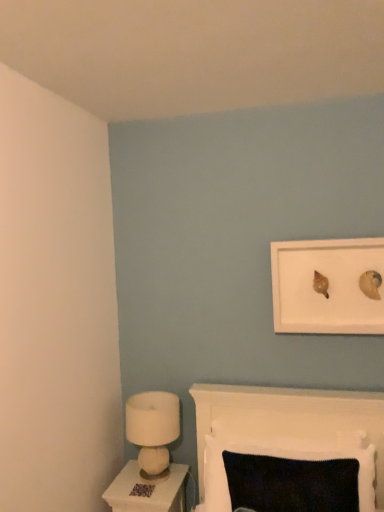
The image size is (384, 512). What do you see at coordinates (291, 416) in the screenshot? I see `knitted fabric cushion at lower center` at bounding box center [291, 416].

This screenshot has width=384, height=512. Identify the location of white matte picture frame at upper right. (328, 286).

Measure the distance between white glossy nightstand at lower left and camera.

white glossy nightstand at lower left is 5.87 feet from camera.

In order to face brown textured carpet at lower center, should I rotate leftwards or rightwards?

It's best to rotate left around 6.460 degrees.

This screenshot has width=384, height=512. I want to click on white felt lamp at lower left, so click(x=153, y=429).

Can you confirm if white matte picture frame at upper right is positioned to the left of white felt lamp at lower left?

No, white matte picture frame at upper right is not to the left of white felt lamp at lower left.

From the image's perspective, is white matte picture frame at upper right above or below white felt lamp at lower left?

white matte picture frame at upper right is situated higher than white felt lamp at lower left in the image.

Is white matte picture frame at upper right with white felt lamp at lower left?

No, white matte picture frame at upper right is not making contact with white felt lamp at lower left.

From the image's perspective, which one is positioned higher, brown textured carpet at lower center or white matte picture frame at upper right?

white matte picture frame at upper right appears higher in the image.

Considering the relative sizes of brown textured carpet at lower center and white matte picture frame at upper right in the image provided, is brown textured carpet at lower center thinner than white matte picture frame at upper right?

Yes, brown textured carpet at lower center is thinner than white matte picture frame at upper right.

Considering the positions of objects brown textured carpet at lower center and white matte picture frame at upper right in the image provided, who is in front, brown textured carpet at lower center or white matte picture frame at upper right?

white matte picture frame at upper right is closer to the camera.

The width and height of the screenshot is (384, 512). I want to click on picture frame that appears on the right of knitted fabric cushion at lower center, so click(x=328, y=286).

Considering the sizes of objects knitted fabric cushion at lower center and white matte picture frame at upper right in the image provided, who is bigger, knitted fabric cushion at lower center or white matte picture frame at upper right?

knitted fabric cushion at lower center.

Would you say knitted fabric cushion at lower center is to the left or to the right of white matte picture frame at upper right in the picture?

From the image, it's evident that knitted fabric cushion at lower center is to the left of white matte picture frame at upper right.

Is the surface of knitted fabric cushion at lower center in direct contact with white matte picture frame at upper right?

No, knitted fabric cushion at lower center is not next to white matte picture frame at upper right.

From the picture: Looking at the image, does knitted fabric cushion at lower center seem bigger or smaller compared to white glossy nightstand at lower left?

Clearly, knitted fabric cushion at lower center is larger in size than white glossy nightstand at lower left.

The height and width of the screenshot is (512, 384). I want to click on furniture to the right of white glossy nightstand at lower left, so click(291, 416).

Is knitted fabric cushion at lower center positioned far away from white glossy nightstand at lower left?

No, knitted fabric cushion at lower center is not far away from white glossy nightstand at lower left.

Is brown textured carpet at lower center oriented towards white felt lamp at lower left?

No, brown textured carpet at lower center is not aimed at white felt lamp at lower left.

Considering the sizes of objects brown textured carpet at lower center and white felt lamp at lower left in the image provided, who is bigger, brown textured carpet at lower center or white felt lamp at lower left?

With larger size is white felt lamp at lower left.

Between brown textured carpet at lower center and white felt lamp at lower left, which one is positioned behind?

white felt lamp at lower left is more distant.

From the image's perspective, does brown textured carpet at lower center appear lower than white felt lamp at lower left?

Correct, brown textured carpet at lower center appears lower than white felt lamp at lower left in the image.

Would you say knitted fabric cushion at lower center is a long distance from brown textured carpet at lower center?

Actually, knitted fabric cushion at lower center and brown textured carpet at lower center are a little close together.

Is knitted fabric cushion at lower center inside the boundaries of brown textured carpet at lower center, or outside?

knitted fabric cushion at lower center cannot be found inside brown textured carpet at lower center.

What's the angular difference between knitted fabric cushion at lower center and brown textured carpet at lower center's facing directions?

The facing directions of knitted fabric cushion at lower center and brown textured carpet at lower center are 0.849 degrees apart.

Which object is positioned more to the left, knitted fabric cushion at lower center or brown textured carpet at lower center?

Positioned to the left is brown textured carpet at lower center.

Does white glossy nightstand at lower left touch white matte picture frame at upper right?

There is a gap between white glossy nightstand at lower left and white matte picture frame at upper right.

Looking at this image, between white glossy nightstand at lower left and white matte picture frame at upper right, which one has smaller width?

white matte picture frame at upper right.

From the image's perspective, is white glossy nightstand at lower left under white matte picture frame at upper right?

Yes, from the image's perspective, white glossy nightstand at lower left is below white matte picture frame at upper right.

Where is `lamp that appears below the white matte picture frame at upper right (from the image's perspective)`? The width and height of the screenshot is (384, 512). lamp that appears below the white matte picture frame at upper right (from the image's perspective) is located at coordinates (153, 429).

Find the location of a particular element. The width and height of the screenshot is (384, 512). footprint behind the white matte picture frame at upper right is located at coordinates (142, 490).

From the image, which object appears to be nearer to white matte picture frame at upper right, knitted fabric cushion at lower center or white felt lamp at lower left?

Based on the image, knitted fabric cushion at lower center appears to be nearer to white matte picture frame at upper right.

Based on their spatial positions, is white matte picture frame at upper right or knitted fabric cushion at lower center closer to brown textured carpet at lower center?

knitted fabric cushion at lower center is closer to brown textured carpet at lower center.

Consider the image. Which object lies further to the anchor point knitted fabric cushion at lower center, white matte picture frame at upper right or white felt lamp at lower left?

Among the two, white matte picture frame at upper right is located further to knitted fabric cushion at lower center.

Which object lies nearer to the anchor point white glossy nightstand at lower left, brown textured carpet at lower center or white felt lamp at lower left?

Based on the image, brown textured carpet at lower center appears to be nearer to white glossy nightstand at lower left.

Which object lies nearer to the anchor point white glossy nightstand at lower left, knitted fabric cushion at lower center or white felt lamp at lower left?

white felt lamp at lower left.

From the image, which object appears to be farther from white glossy nightstand at lower left, white felt lamp at lower left or brown textured carpet at lower center?

white felt lamp at lower left is further to white glossy nightstand at lower left.

When comparing their distances from white felt lamp at lower left, does knitted fabric cushion at lower center or brown textured carpet at lower center seem closer?

Based on the image, brown textured carpet at lower center appears to be nearer to white felt lamp at lower left.

Which object lies nearer to the anchor point white matte picture frame at upper right, white felt lamp at lower left or brown textured carpet at lower center?

white felt lamp at lower left is closer to white matte picture frame at upper right.

The image size is (384, 512). Find the location of `furniture between white matte picture frame at upper right and white glossy nightstand at lower left vertically`. furniture between white matte picture frame at upper right and white glossy nightstand at lower left vertically is located at coordinates (291, 416).

Identify the location of lamp between white glossy nightstand at lower left and knitted fabric cushion at lower center. (153, 429).

Where is `lamp that lies between white matte picture frame at upper right and white glossy nightstand at lower left from top to bottom`? This screenshot has height=512, width=384. lamp that lies between white matte picture frame at upper right and white glossy nightstand at lower left from top to bottom is located at coordinates (153, 429).

Identify the location of footprint between white matte picture frame at upper right and white glossy nightstand at lower left in the up-down direction. (142, 490).